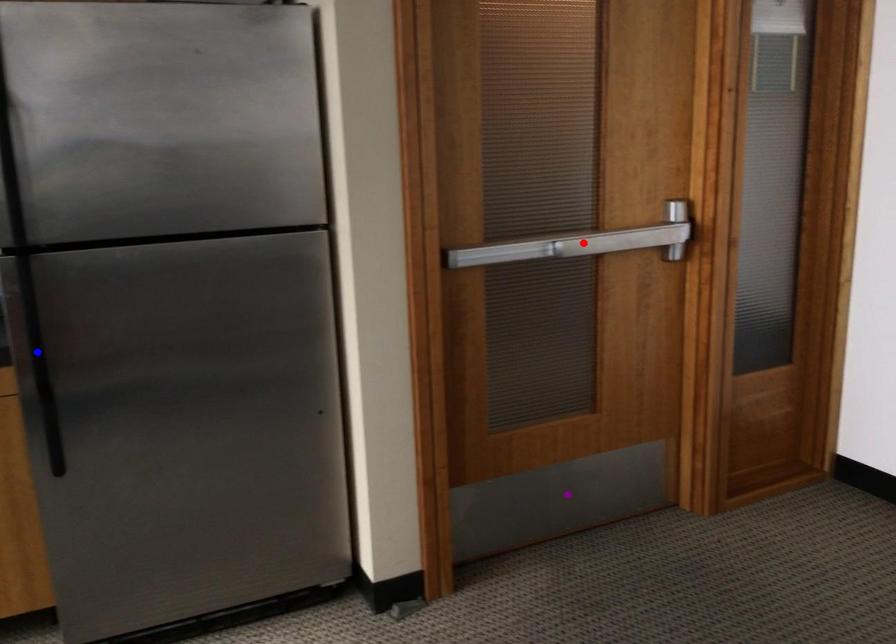
Order these from farthest to nearest:
1. blue point
2. purple point
3. red point

purple point → red point → blue point